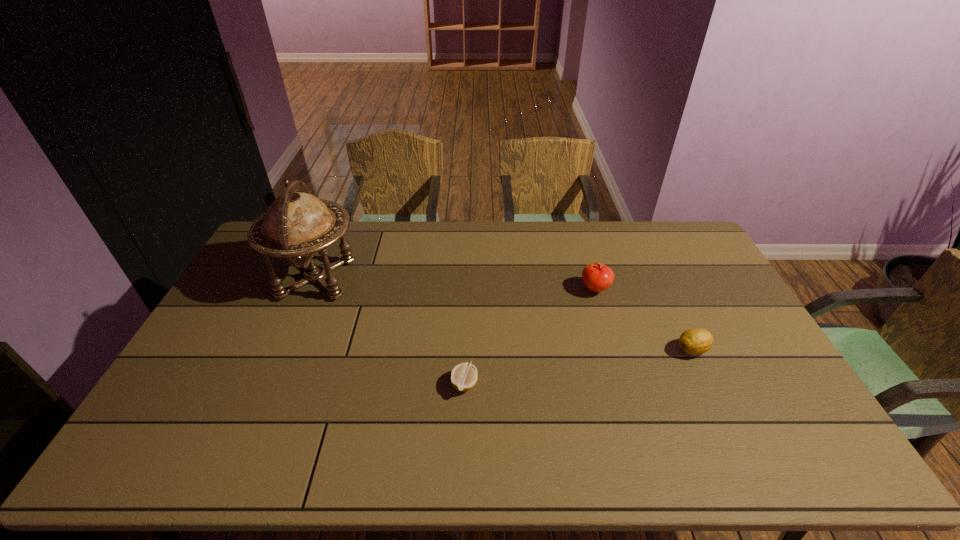
Where is `free spot that satisfies the following two spatial constraints: 1. on the front-facing side of the tallest object; 2. on the right side of the shortest object`? free spot that satisfies the following two spatial constraints: 1. on the front-facing side of the tallest object; 2. on the right side of the shortest object is located at coordinates (272, 384).

I want to click on vacant space that satisfies the following two spatial constraints: 1. on the front-facing side of the nearer lemon; 2. on the left side of the leftmost object, so click(x=272, y=384).

Identify the location of vacant space that satisfies the following two spatial constraints: 1. on the back side of the third shortest object; 2. on the front-facing side of the leftmost object. This screenshot has height=540, width=960. (591, 279).

This screenshot has height=540, width=960. I want to click on free spot that satisfies the following two spatial constraints: 1. on the front-facing side of the left lemon; 2. on the right side of the leftmost object, so click(x=272, y=384).

Identify the location of free space that satisfies the following two spatial constraints: 1. on the front-facing side of the apple; 2. on the left side of the globe. The width and height of the screenshot is (960, 540). (312, 289).

Locate an element on the screen. The width and height of the screenshot is (960, 540). blank area in the image that satisfies the following two spatial constraints: 1. on the front-facing side of the leftmost object; 2. on the back side of the apple is located at coordinates (312, 289).